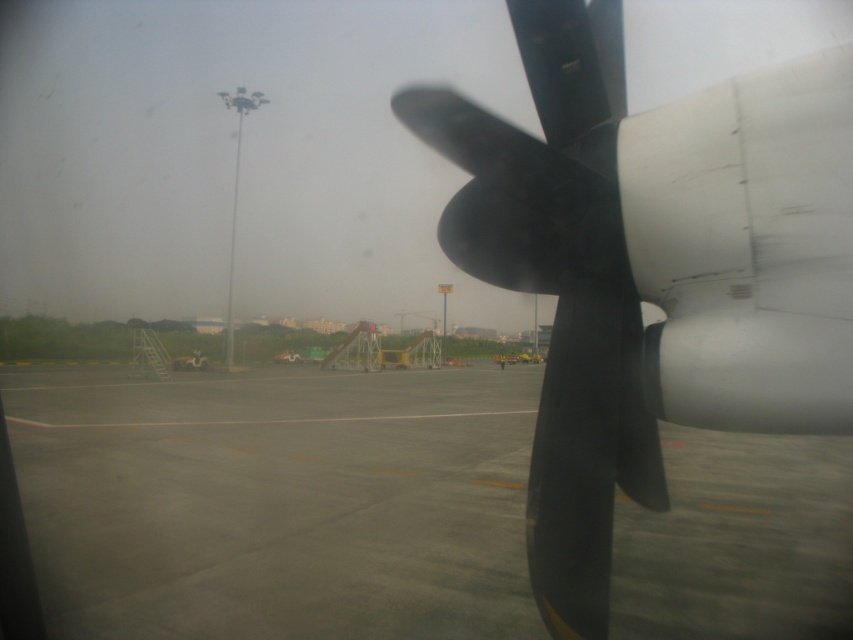
Consider the image. You are a passenger sitting near the window on this aircraft. You notice two points marked on the tarmac outside. The first point is at coordinates point (x=816, y=536) and the second is at point (x=575, y=372). From your seated position, which point is closer to the aircraft?

Point (x=575, y=372) is closer to the aircraft because it is in front of point (x=816, y=536), which is behind it.

You are a pilot preparing for takeoff and notice a point marked at coordinates (276,500) in the image. Based on the scene description, what does this point most likely represent?

The point at (276,500) most likely represents the gray concrete runway at center as indicated by the coordinates.

You are a pilot preparing for takeoff and need to ensure that the runway length is sufficient for your aircraft. Given that the aircraft requires a minimum runway length of 100 meters, can you determine if the gray concrete runway at center is long enough based on its comparison to the matte black propeller at center?

The gray concrete runway at center is shorter than the matte black propeller at center. Since the runway is shorter than the propeller, it is unlikely to meet the required 100 meters needed for takeoff. Please verify with ground control for accurate measurements.